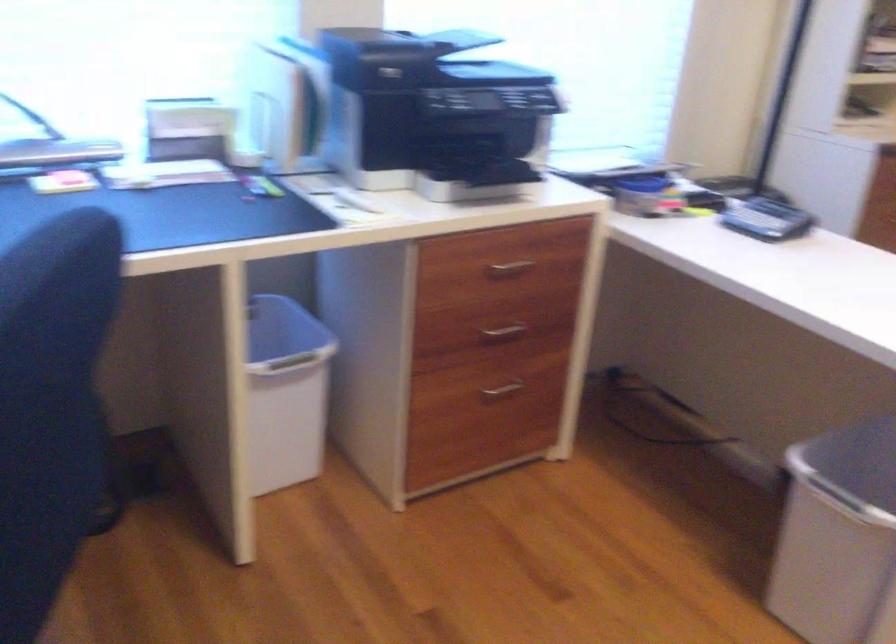
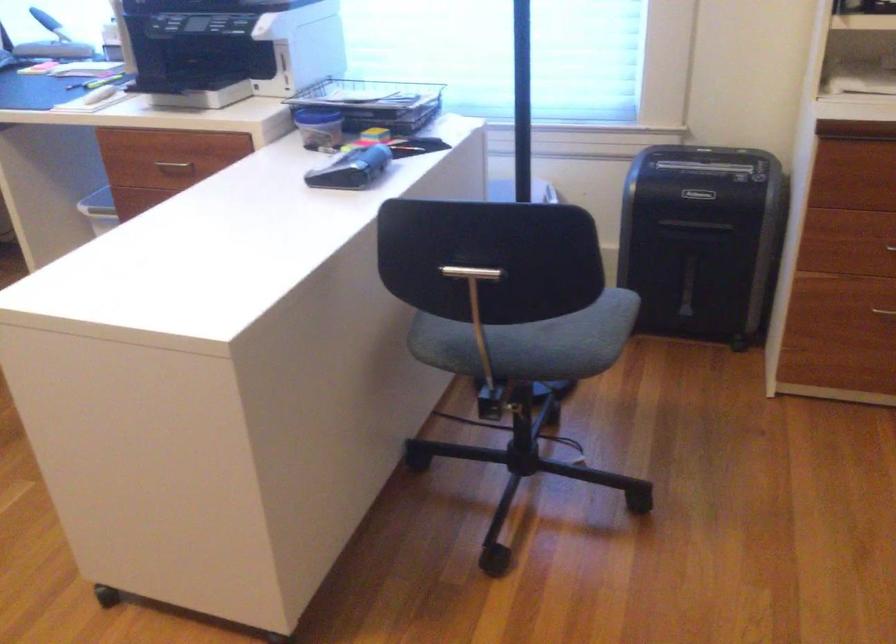
Question: I am providing you with two images of the same scene from different viewpoints. After the viewpoint changes to image2, which objects are now occluded?

Choices:
 (A) wire paper tray
 (B) small alarm clock
 (C) silver drawer handle
 (D) black tape dispenser

Answer: (C)